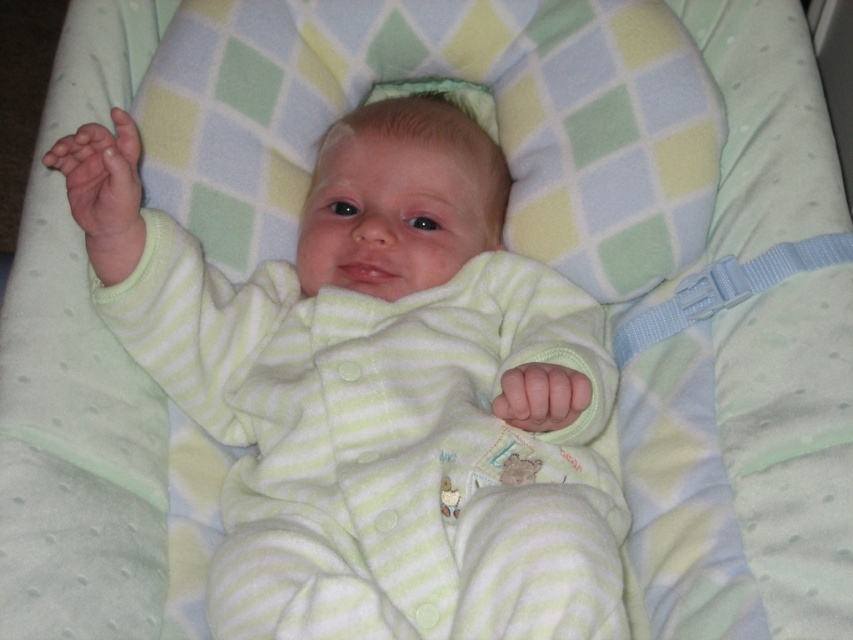
Question: Among these points, which one is farthest from the camera?

Choices:
 (A) (103, 150)
 (B) (200, 339)

Answer: (B)

Question: Does light green striped onesie at center have a smaller size compared to transparent plastic teething ring at upper left?

Choices:
 (A) no
 (B) yes

Answer: (A)

Question: Does light green striped onesie at center have a larger size compared to transparent plastic teething ring at upper left?

Choices:
 (A) no
 (B) yes

Answer: (B)

Question: Can you confirm if light green striped onesie at center is positioned to the left of transparent plastic teething ring at upper left?

Choices:
 (A) no
 (B) yes

Answer: (A)

Question: Which object appears farthest from the camera in this image?

Choices:
 (A) light green striped onesie at center
 (B) transparent plastic teething ring at upper left

Answer: (B)